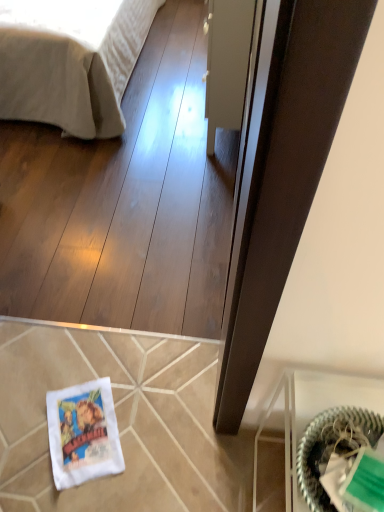
The height and width of the screenshot is (512, 384). Find the location of `beige cotton bed at upper left`. beige cotton bed at upper left is located at coordinates (71, 61).

This screenshot has width=384, height=512. What do you see at coordinates (227, 64) in the screenshot? I see `transparent glass door at center` at bounding box center [227, 64].

Where is `green woven basket at lower right`? green woven basket at lower right is located at coordinates (332, 447).

Between point (355, 438) and point (248, 8), which one is positioned in front?

The point (355, 438) is in front.

From a real-world perspective, between green woven basket at lower right and transparent glass door at center, who is vertically higher?

green woven basket at lower right, from a real-world perspective.

Considering the sizes of objects green woven basket at lower right and transparent glass door at center in the image provided, who is smaller, green woven basket at lower right or transparent glass door at center?

Smaller between the two is green woven basket at lower right.

From the image's perspective, which is above, transparent glass door at center or beige cotton bed at upper left?

beige cotton bed at upper left.

Who is shorter, transparent glass door at center or beige cotton bed at upper left?

beige cotton bed at upper left is shorter.

Is transparent glass door at center oriented towards beige cotton bed at upper left?

Yes, transparent glass door at center is aimed at beige cotton bed at upper left.

Does transparent glass door at center have a greater width compared to beige cotton bed at upper left?

Incorrect, the width of transparent glass door at center does not surpass that of beige cotton bed at upper left.

Does point (61, 22) come closer to viewer compared to point (78, 470)?

No, (61, 22) is further to viewer.

Who is shorter, beige cotton bed at upper left or white fabric bag at lower left?

white fabric bag at lower left.

You are a GUI agent. You are given a task and a screenshot of the screen. Output one action in this format:
    pyautogui.click(x=<x>, y=<y>)
    Task: Click on the bed that appears above the white fabric bag at lower left (from a real-world perspective)
    The width and height of the screenshot is (384, 512).
    Given the screenshot: What is the action you would take?
    pyautogui.click(x=71, y=61)

Is beige cotton bed at upper left far away from white fabric bag at lower left?

Yes, beige cotton bed at upper left and white fabric bag at lower left are quite far apart.

Can you confirm if green woven basket at lower right is positioned to the right of beige cotton bed at upper left?

Yes, green woven basket at lower right is to the right of beige cotton bed at upper left.

Considering the relative sizes of green woven basket at lower right and beige cotton bed at upper left in the image provided, is green woven basket at lower right wider than beige cotton bed at upper left?

No.

From a real-world perspective, is green woven basket at lower right physically below beige cotton bed at upper left?

Actually, green woven basket at lower right is physically above beige cotton bed at upper left in the real world.

Is point (370, 415) positioned in front of point (102, 134)?

Yes, point (370, 415) is closer to viewer.

How different are the orientations of transparent glass door at center and white fabric bag at lower left in degrees?

The angular difference between transparent glass door at center and white fabric bag at lower left is 65.7 degrees.

What are the coordinates of `glass door behind the white fabric bag at lower left` in the screenshot? It's located at (227, 64).

Based on the photo, how distant is transparent glass door at center from white fabric bag at lower left?

They are 4.54 feet apart.

From the image's perspective, which is above, transparent glass door at center or white fabric bag at lower left?

transparent glass door at center is shown above in the image.

Considering the points (16, 75) and (241, 26), which point is in front, point (16, 75) or point (241, 26)?

The point (241, 26) is closer to the camera.

Between beige cotton bed at upper left and transparent glass door at center, which one has smaller width?

Thinner between the two is transparent glass door at center.

From a real-world perspective, which is physically below, beige cotton bed at upper left or transparent glass door at center?

beige cotton bed at upper left is physically lower.

Is the position of white fabric bag at lower left less distant than that of transparent glass door at center?

Yes.

Are white fabric bag at lower left and transparent glass door at center far apart?

Yes.

From the image's perspective, is white fabric bag at lower left beneath transparent glass door at center?

Indeed, from the image's perspective, white fabric bag at lower left is shown beneath transparent glass door at center.

This screenshot has height=512, width=384. I want to click on glass door that is above the white fabric bag at lower left (from the image's perspective), so click(x=227, y=64).

Identify the location of basket located on the right of transparent glass door at center. (332, 447).

The width and height of the screenshot is (384, 512). I want to click on bed that is under the transparent glass door at center (from a real-world perspective), so 71,61.

Considering their positions, is white fabric bag at lower left positioned further to transparent glass door at center than green woven basket at lower right?

green woven basket at lower right lies further to transparent glass door at center than the other object.

Which object lies further to the anchor point green woven basket at lower right, beige cotton bed at upper left or transparent glass door at center?

Based on the image, beige cotton bed at upper left appears to be further to green woven basket at lower right.

Which object lies further to the anchor point transparent glass door at center, beige cotton bed at upper left or green woven basket at lower right?

green woven basket at lower right.

Considering their positions, is green woven basket at lower right positioned further to white fabric bag at lower left than beige cotton bed at upper left?

beige cotton bed at upper left is further to white fabric bag at lower left.

Looking at the image, which one is located further to white fabric bag at lower left, transparent glass door at center or beige cotton bed at upper left?

beige cotton bed at upper left.

Considering their positions, is transparent glass door at center positioned closer to green woven basket at lower right than beige cotton bed at upper left?

transparent glass door at center.

Considering their positions, is white fabric bag at lower left positioned further to green woven basket at lower right than beige cotton bed at upper left?

beige cotton bed at upper left is positioned further to the anchor green woven basket at lower right.

Looking at the image, which one is located closer to green woven basket at lower right, white fabric bag at lower left or transparent glass door at center?

white fabric bag at lower left is positioned closer to the anchor green woven basket at lower right.

Locate an element on the screen. This screenshot has width=384, height=512. glass door between beige cotton bed at upper left and green woven basket at lower right in the vertical direction is located at coordinates [x=227, y=64].

You are a GUI agent. You are given a task and a screenshot of the screen. Output one action in this format:
    pyautogui.click(x=<x>, y=<y>)
    Task: Click on the basket between transparent glass door at center and white fabric bag at lower left from top to bottom
    
    Given the screenshot: What is the action you would take?
    pyautogui.click(x=332, y=447)

Identify the location of basket between beige cotton bed at upper left and white fabric bag at lower left in the up-down direction. (332, 447).

Where is `glass door between beige cotton bed at upper left and white fabric bag at lower left vertically`? glass door between beige cotton bed at upper left and white fabric bag at lower left vertically is located at coordinates (227, 64).